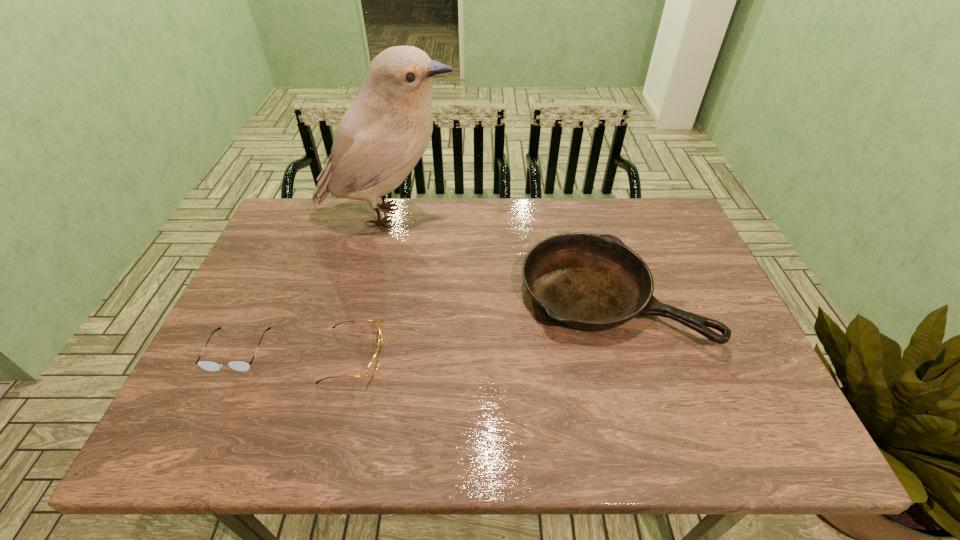
I want to click on vacant space that is in between the frying pan and the left spectacles, so click(424, 323).

Where is `empty space between the shortest object and the right spectacles`? empty space between the shortest object and the right spectacles is located at coordinates (296, 353).

This screenshot has width=960, height=540. In order to click on object that is the third closest one to the right spectacles in this screenshot , I will do `click(386, 130)`.

This screenshot has width=960, height=540. Find the location of `object that is the second closest one to the frying pan`. object that is the second closest one to the frying pan is located at coordinates (x=372, y=367).

Where is `free location that satisfies the following two spatial constraints: 1. on the back side of the second tallest object; 2. on the face of the farthest object`? The width and height of the screenshot is (960, 540). free location that satisfies the following two spatial constraints: 1. on the back side of the second tallest object; 2. on the face of the farthest object is located at coordinates (587, 215).

Identify the location of free point that satisfies the following two spatial constraints: 1. on the face of the farthest object; 2. on the right side of the rightmost object. (369, 296).

You are a GUI agent. You are given a task and a screenshot of the screen. Output one action in this format:
    pyautogui.click(x=<x>, y=<y>)
    Task: Click on the vacant space that satisfies the following two spatial constraints: 1. on the face of the parakeet; 2. on the lenses of the shortest object
    
    Given the screenshot: What is the action you would take?
    pyautogui.click(x=355, y=350)